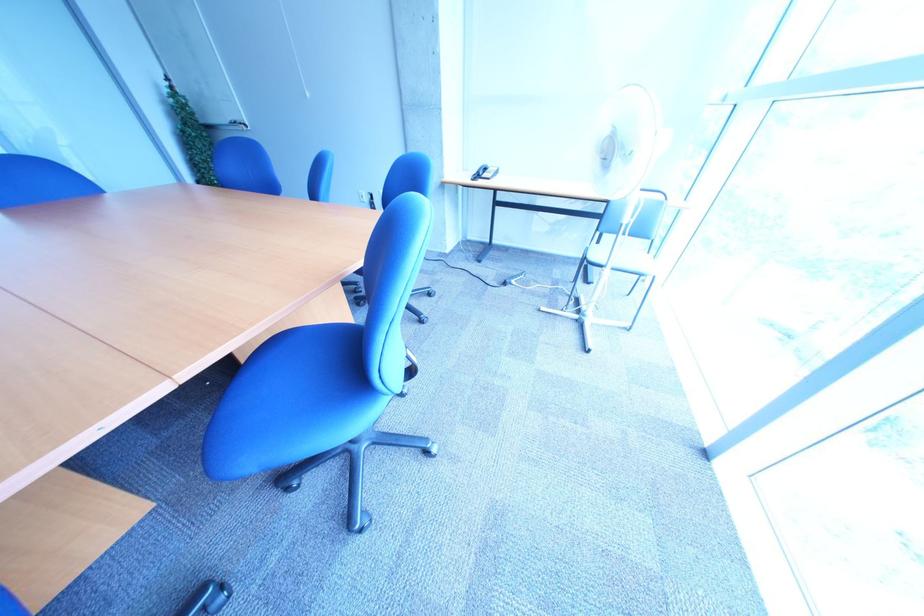
Where is `telephone handset`? This screenshot has width=924, height=616. telephone handset is located at coordinates (484, 172).